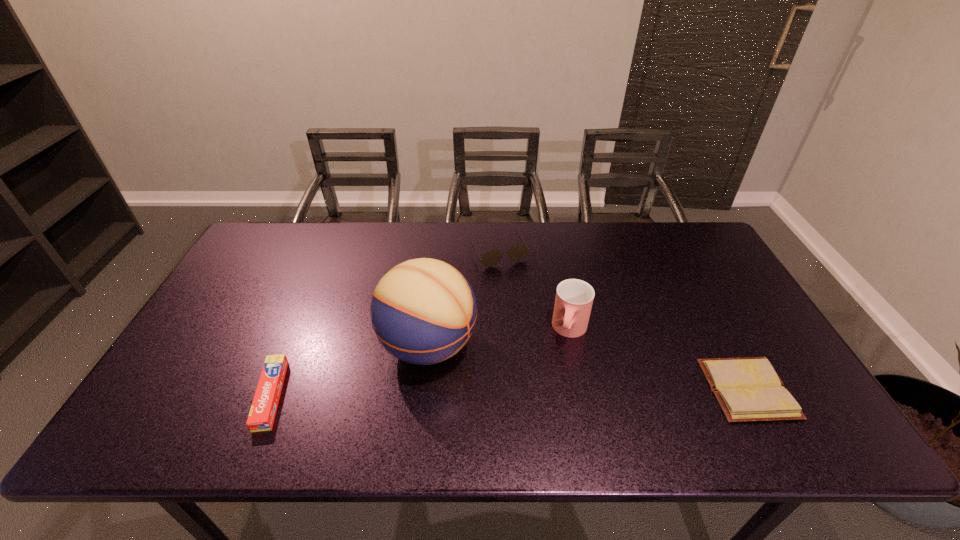
Identify the location of free space in the image that satisfies the following two spatial constraints: 1. on the back side of the fourth object from left to right; 2. on the right side of the fourth tallest object. This screenshot has width=960, height=540. (299, 330).